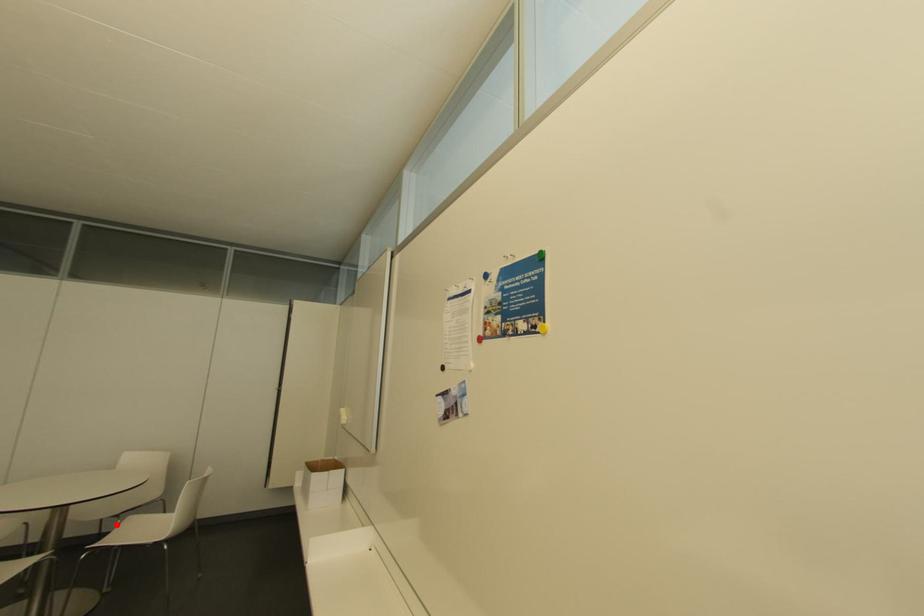
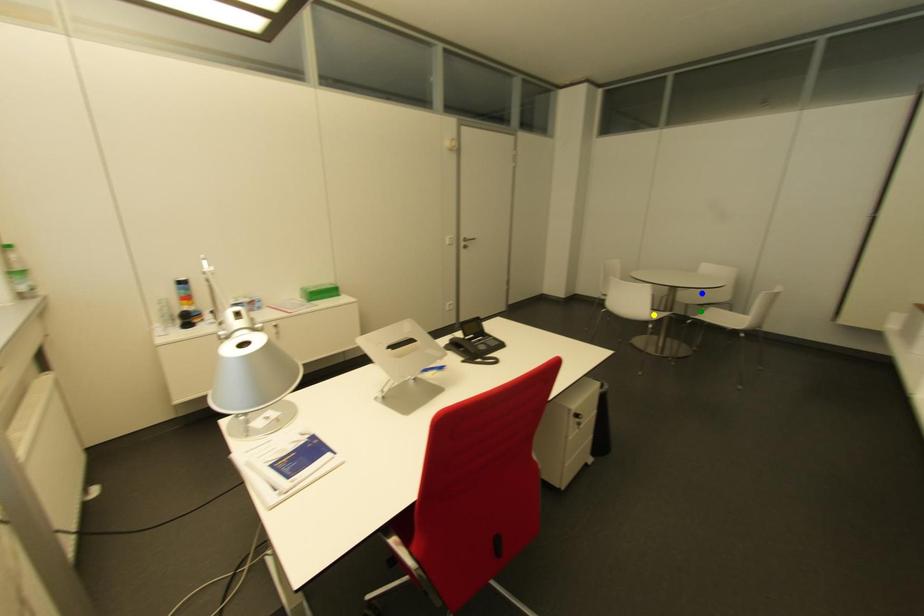
Question: I am providing you with two images of the same scene from different viewpoints. A red point is marked on the first image. You are given multiple points on the second image. Which point in image 2 represents the same 3d spot as the red point in image 1?

Choices:
 (A) yellow point
 (B) green point
 (C) blue point

Answer: (B)